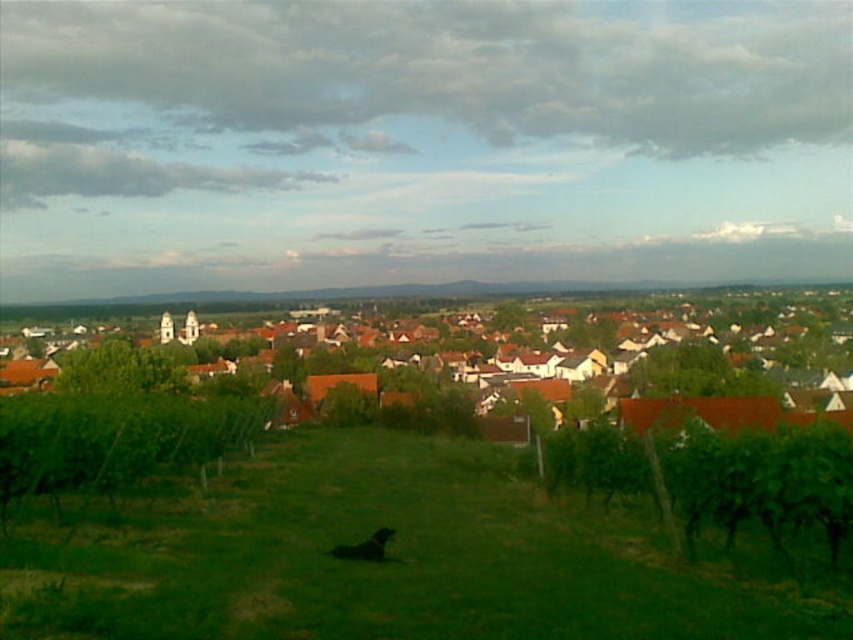
You are a bird flying over the rural landscape. You want to land on the highest point between the green grassy field at center and the brown tiled roofs at center. Which one should you choose?

The brown tiled roofs at center are higher than the green grassy field at center, so you should land on the brown tiled roofs at center.

You are a drone operator trying to capture a photo of the village. Your drone has a camera with a 10m wide lens. If you position the drone so that the green grassy field at center and brown tiled roofs at center are both in frame, which object will occupy more horizontal space in the photo?

The brown tiled roofs at center will occupy more horizontal space in the photo because the green grassy field at center is narrower than the brown tiled roofs at center.